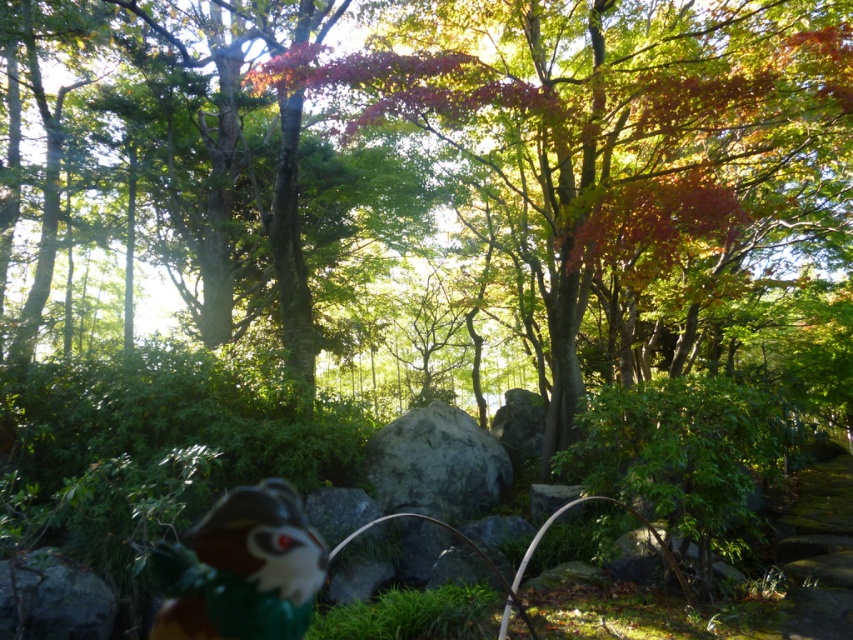
Question: Which point appears closest to the camera in this image?

Choices:
 (A) (489, 477)
 (B) (209, 560)
 (C) (808, 324)

Answer: (B)

Question: Which point is closer to the camera taking this photo?

Choices:
 (A) (819, 88)
 (B) (500, 477)

Answer: (A)

Question: Which point is farther to the camera?

Choices:
 (A) green leafy tree at center
 (B) gray rough rock at center
 (C) brown matte plush toy at lower left

Answer: (B)

Question: From the image, what is the correct spatial relationship of brown matte plush toy at lower left in relation to gray rough rock at center?

Choices:
 (A) left
 (B) right

Answer: (A)

Question: Is the position of green leafy tree at center less distant than that of brown matte plush toy at lower left?

Choices:
 (A) no
 (B) yes

Answer: (A)

Question: Does brown matte plush toy at lower left appear over gray rough rock at center?

Choices:
 (A) yes
 (B) no

Answer: (B)